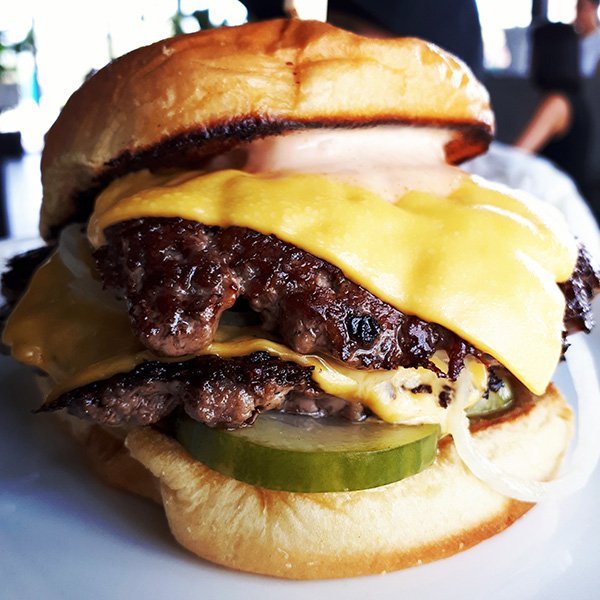
The width and height of the screenshot is (600, 600). What are the coordinates of `plate` in the screenshot? It's located at (126, 545).